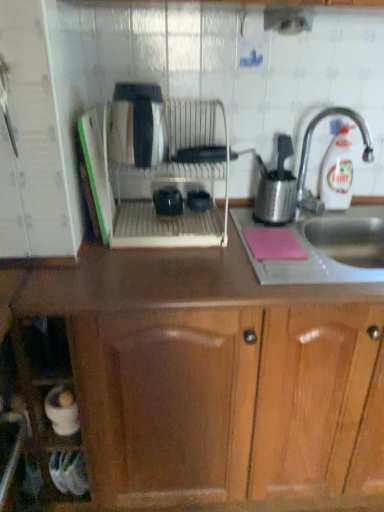
Question: Is white plastic bottle at upper right turned away from pink matte notepad at lower right?

Choices:
 (A) yes
 (B) no

Answer: (B)

Question: Is white plastic bottle at upper right smaller than pink matte notepad at lower right?

Choices:
 (A) yes
 (B) no

Answer: (B)

Question: Is white plastic bottle at upper right touching pink matte notepad at lower right?

Choices:
 (A) no
 (B) yes

Answer: (A)

Question: Is the depth of white plastic bottle at upper right less than that of pink matte notepad at lower right?

Choices:
 (A) no
 (B) yes

Answer: (A)

Question: From a real-world perspective, is white plastic bottle at upper right located beneath pink matte notepad at lower right?

Choices:
 (A) no
 (B) yes

Answer: (A)

Question: Is white plastic bottle at upper right wider than pink matte notepad at lower right?

Choices:
 (A) yes
 (B) no

Answer: (B)

Question: Is black plastic bowls at center, which is the 2th appliance in left-to-right order, completely or partially inside metallic sink at right?

Choices:
 (A) yes
 (B) no

Answer: (B)

Question: Is metallic sink at right smaller than black plastic bowls at center, which is the 2th appliance in left-to-right order?

Choices:
 (A) yes
 (B) no

Answer: (B)

Question: From the image's perspective, is metallic sink at right below black plastic bowls at center, arranged as the first appliance when viewed from the right?

Choices:
 (A) no
 (B) yes

Answer: (B)

Question: Is metallic sink at right further to the viewer compared to black plastic bowls at center, which is the 2th appliance in left-to-right order?

Choices:
 (A) no
 (B) yes

Answer: (A)

Question: Are metallic sink at right and black plastic bowls at center, arranged as the first appliance when viewed from the right, far apart?

Choices:
 (A) yes
 (B) no

Answer: (B)

Question: Is metallic sink at right taller than black plastic bowls at center, arranged as the first appliance when viewed from the right?

Choices:
 (A) yes
 (B) no

Answer: (A)

Question: Can white plastic bottle at upper right be found inside black plastic bowls at center, arranged as the first appliance when viewed from the right?

Choices:
 (A) yes
 (B) no

Answer: (B)